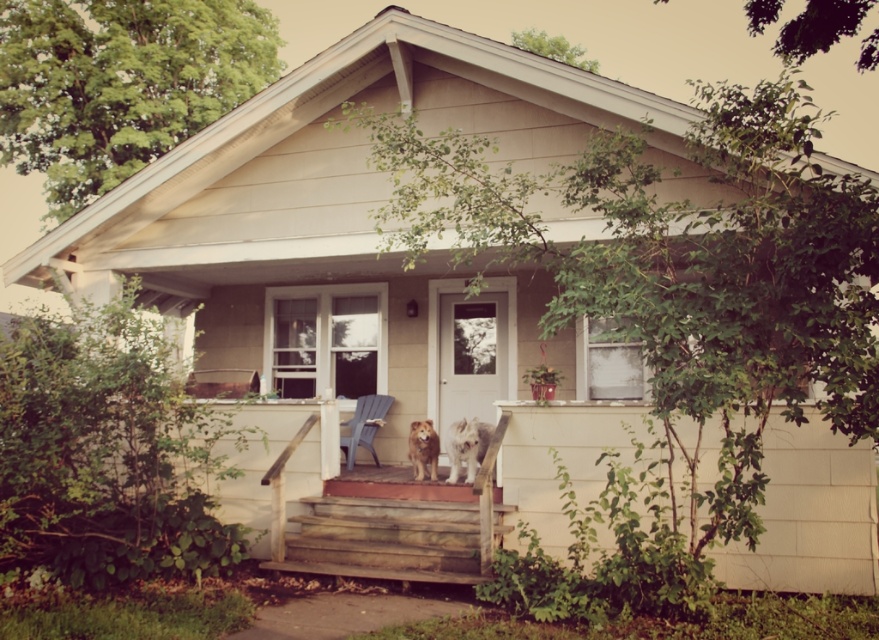
Question: Which object is positioned closest to the fuzzy white dog at center?

Choices:
 (A) weathered wood stairs at center
 (B) brown furry dog at center

Answer: (B)

Question: Does weathered wood stairs at center have a larger size compared to brown furry dog at center?

Choices:
 (A) yes
 (B) no

Answer: (A)

Question: Estimate the real-world distances between objects in this image. Which object is farther from the fuzzy white dog at center?

Choices:
 (A) light blue plastic chair at center
 (B) white matte screen door at center
 (C) wooden stairs at center
 (D) brown furry dog at center

Answer: (B)

Question: Does weathered wood stairs at center appear on the right side of brown furry dog at center?

Choices:
 (A) no
 (B) yes

Answer: (A)

Question: Which of these objects is positioned closest to the fuzzy white dog at center?

Choices:
 (A) weathered wood stairs at center
 (B) white matte screen door at center
 (C) wooden bench at center

Answer: (A)

Question: Does white matte screen door at center appear on the left side of brown furry dog at center?

Choices:
 (A) yes
 (B) no

Answer: (B)